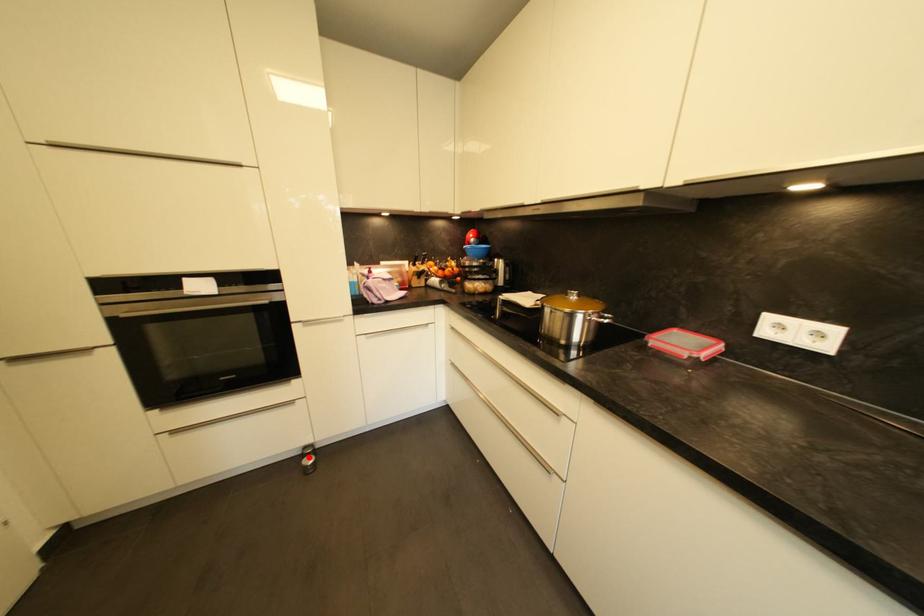
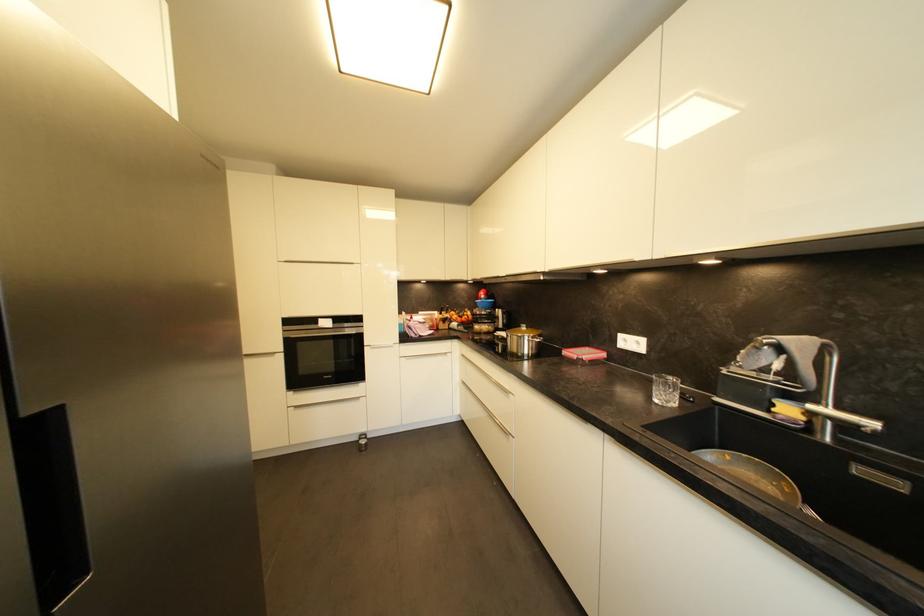
In the second image, find the point that corresponds to the highlighted location in the first image.

(365, 440)